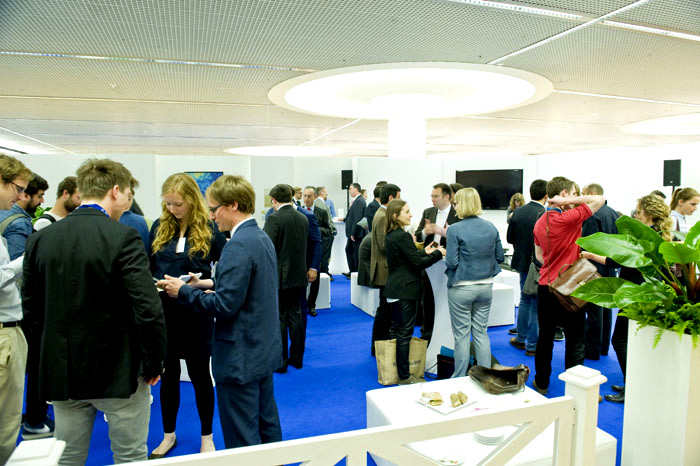
The image size is (700, 466). I want to click on ceiling, so click(288, 28).